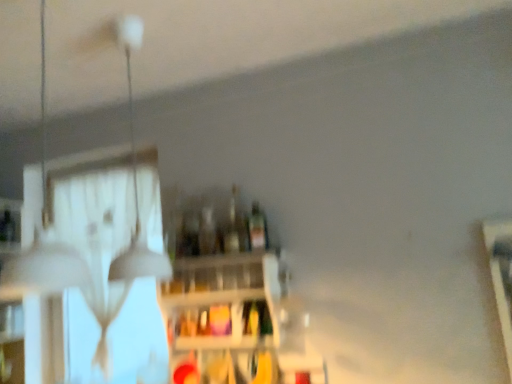
Question: Considering the relative sizes of transparent glass bottle at center, acting as the 2th bottle starting from the left, and matte yellow glass at center in the image provided, is transparent glass bottle at center, acting as the 2th bottle starting from the left, taller than matte yellow glass at center?

Choices:
 (A) yes
 (B) no

Answer: (A)

Question: Does transparent glass bottle at center, acting as the 2th bottle starting from the left, come behind matte yellow glass at center?

Choices:
 (A) no
 (B) yes

Answer: (B)

Question: Is transparent glass bottle at center, acting as the 2th bottle starting from the left, not inside matte yellow glass at center?

Choices:
 (A) yes
 (B) no

Answer: (A)

Question: Is transparent glass bottle at center, acting as the 2th bottle starting from the left, surrounding matte yellow glass at center?

Choices:
 (A) no
 (B) yes

Answer: (A)

Question: Is transparent glass bottle at center, arranged as the second bottle when viewed from the right, positioned in front of matte yellow glass at center?

Choices:
 (A) yes
 (B) no

Answer: (B)

Question: Can you confirm if transparent glass bottle at center, arranged as the second bottle when viewed from the right, is smaller than matte yellow glass at center?

Choices:
 (A) yes
 (B) no

Answer: (B)

Question: Is translucent glass bottle at center, the 1th bottle when ordered from left to right, located outside white matte lampshade at upper left, which appears as the 1th lamp when viewed from the front?

Choices:
 (A) yes
 (B) no

Answer: (A)

Question: Is translucent glass bottle at center, the 1th bottle when ordered from left to right, wider than white matte lampshade at upper left, arranged as the 2th lamp when viewed from the back?

Choices:
 (A) yes
 (B) no

Answer: (B)

Question: From the image's perspective, would you say translucent glass bottle at center, the 1th bottle when ordered from left to right, is shown under white matte lampshade at upper left, which appears as the 1th lamp when viewed from the front?

Choices:
 (A) no
 (B) yes

Answer: (B)

Question: Can you confirm if translucent glass bottle at center, which appears as the 3th bottle when viewed from the right, is shorter than white matte lampshade at upper left, which appears as the 1th lamp when viewed from the front?

Choices:
 (A) yes
 (B) no

Answer: (A)

Question: Would you say white matte lampshade at upper left, arranged as the 2th lamp when viewed from the back, is part of translucent glass bottle at center, the 1th bottle when ordered from left to right,'s contents?

Choices:
 (A) no
 (B) yes

Answer: (A)

Question: From the image's perspective, is translucent glass bottle at center, which appears as the 3th bottle when viewed from the right, located above white matte lampshade at upper left, arranged as the 2th lamp when viewed from the back?

Choices:
 (A) no
 (B) yes

Answer: (A)

Question: Is transparent glass door at upper left taller than white matte lampshade at upper left, the first lamp viewed from the back?

Choices:
 (A) no
 (B) yes

Answer: (B)